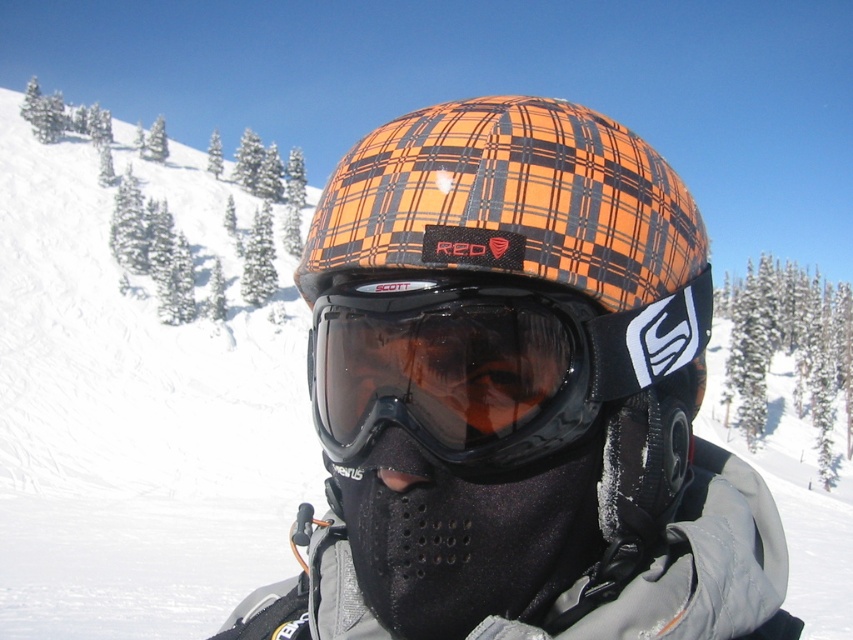
You are navigating a path through the snowy mountain scene. There are two points marked on your map at coordinates point (334, 378) and point (451, 422). If you are facing the direction of the person in the image, which point is closer to you?

Point (451, 422) is closer to you because it is in front of point (334, 378), which is behind it.

You are a photographer trying to capture the orange plaid helmet at center and the transparent plastic goggles at center in a single shot. Which object will appear closer to the camera in the photo?

The orange plaid helmet at center will appear closer to the camera because it is further to the viewer than the transparent plastic goggles at center.

You are a photographer trying to capture the perfect shot of the person in the scene. You want to ensure the subject is in focus. Given that your camera has a depth of field that can sharply focus on objects within 30 inches from the camera, will the point at coordinates point (647, 147) be within the focus range?

The point at coordinates point (647, 147) is 30.82 inches from the camera. Since the depth of field can focus within 30 inches, the point is slightly beyond the focus range and may not be in sharp focus.